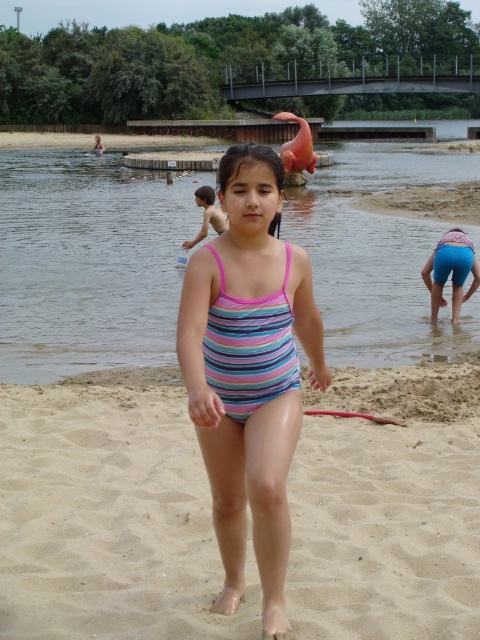
Question: Which of these objects is positioned farthest from the smooth sand at center?

Choices:
 (A) blue stretchy shorts at lower right
 (B) striped fabric swimsuit at center

Answer: (A)

Question: Can you confirm if striped fabric swimsuit at center is positioned to the left of blue stretchy shorts at lower right?

Choices:
 (A) yes
 (B) no

Answer: (A)

Question: Which point is closer to the camera taking this photo?

Choices:
 (A) (16, 529)
 (B) (440, 291)
 (C) (59, 225)
 (D) (288, 547)

Answer: (D)

Question: Considering the relative positions of smooth sand at center and striped fabric swimsuit at center in the image provided, where is smooth sand at center located with respect to striped fabric swimsuit at center?

Choices:
 (A) above
 (B) below

Answer: (B)

Question: Can you confirm if striped fabric swimsuit at center is positioned below pink striped swimsuit at center?

Choices:
 (A) no
 (B) yes

Answer: (B)

Question: Estimate the real-world distances between objects in this image. Which object is farther from the clear water at center?

Choices:
 (A) blue stretchy shorts at lower right
 (B) pink striped swimsuit at center
 (C) striped fabric swimsuit at center

Answer: (C)